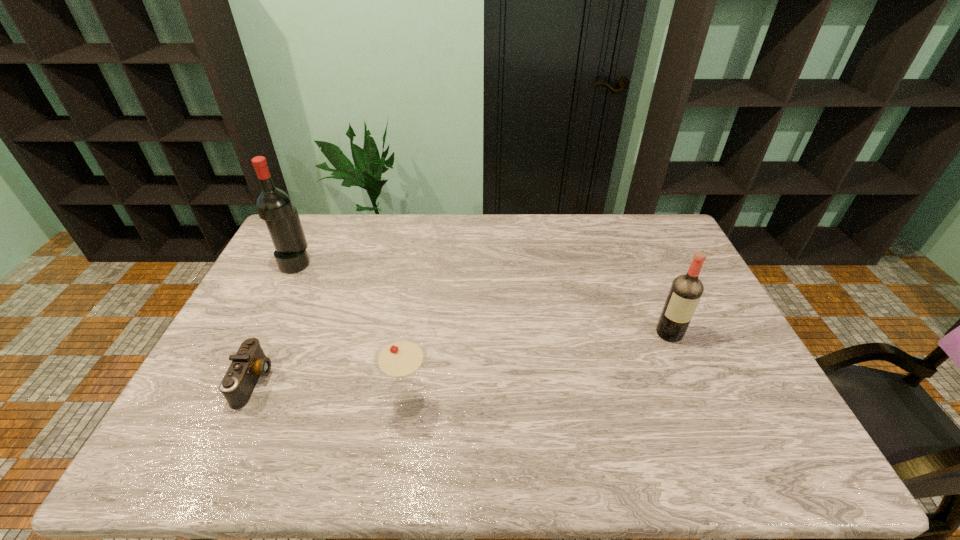
The image size is (960, 540). Find the location of `wine bottle`. wine bottle is located at coordinates (273, 205).

Locate an element on the screen. This screenshot has height=540, width=960. the farthest object is located at coordinates (273, 205).

You are a GUI agent. You are given a task and a screenshot of the screen. Output one action in this format:
    pyautogui.click(x=<x>, y=<y>)
    Task: Click on the rightmost object
    The height and width of the screenshot is (540, 960).
    Given the screenshot: What is the action you would take?
    pyautogui.click(x=686, y=290)

Find the location of `liquor`. liquor is located at coordinates (686, 290).

Where is `the third tallest object`? The image size is (960, 540). the third tallest object is located at coordinates (400, 357).

Locate an element on the screen. The height and width of the screenshot is (540, 960). martini is located at coordinates (400, 357).

Locate an element on the screen. This screenshot has width=960, height=540. the shortest object is located at coordinates (250, 362).

Where is `vacant area situated 0.400m on the right of the tallest object`? vacant area situated 0.400m on the right of the tallest object is located at coordinates (426, 263).

Locate an element on the screen. Image resolution: width=960 pixels, height=540 pixels. free space located 0.130m on the front-facing side of the second tallest object is located at coordinates tap(690, 381).

This screenshot has height=540, width=960. Identify the location of vacant region located 0.320m on the right of the second object from right to left. (561, 403).